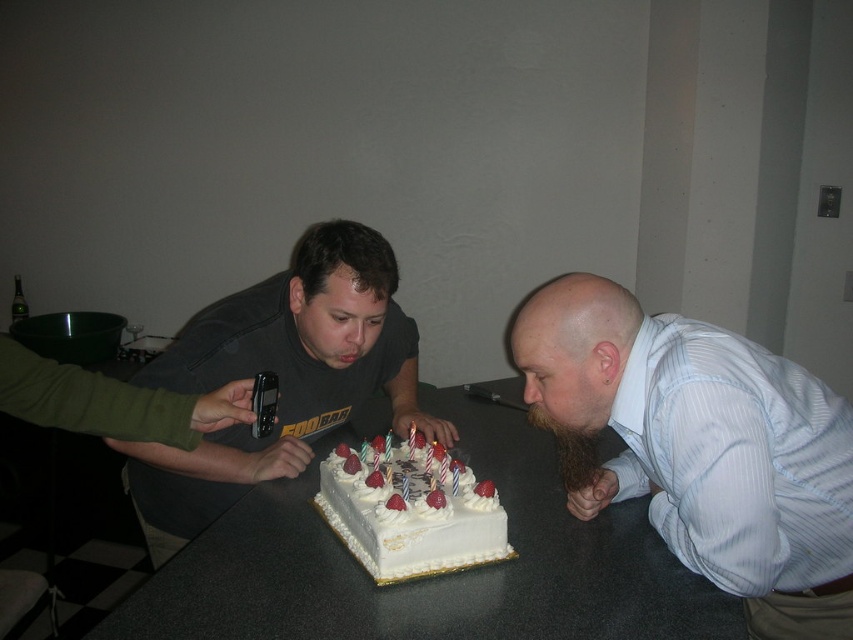
Is white glossy table at center smaller than white frosted cake at center?

Incorrect, white glossy table at center is not smaller in size than white frosted cake at center.

Can you confirm if white glossy table at center is bigger than white frosted cake at center?

Indeed, white glossy table at center has a larger size compared to white frosted cake at center.

Find the location of a particular element. white glossy table at center is located at coordinates (431, 579).

Is light blue striped shirt at lower right above white frosted cake at center?

Indeed, light blue striped shirt at lower right is positioned over white frosted cake at center.

Locate an element on the screen. Image resolution: width=853 pixels, height=640 pixels. light blue striped shirt at lower right is located at coordinates (700, 448).

Who is more forward, (796,480) or (120,624)?

Point (120,624)

Who is more forward, (828, 452) or (289, 531)?

Point (828, 452)

You are a GUI agent. You are given a task and a screenshot of the screen. Output one action in this format:
    pyautogui.click(x=<x>, y=<y>)
    Task: Click on the light blue striped shirt at lower right
    
    Given the screenshot: What is the action you would take?
    pyautogui.click(x=700, y=448)